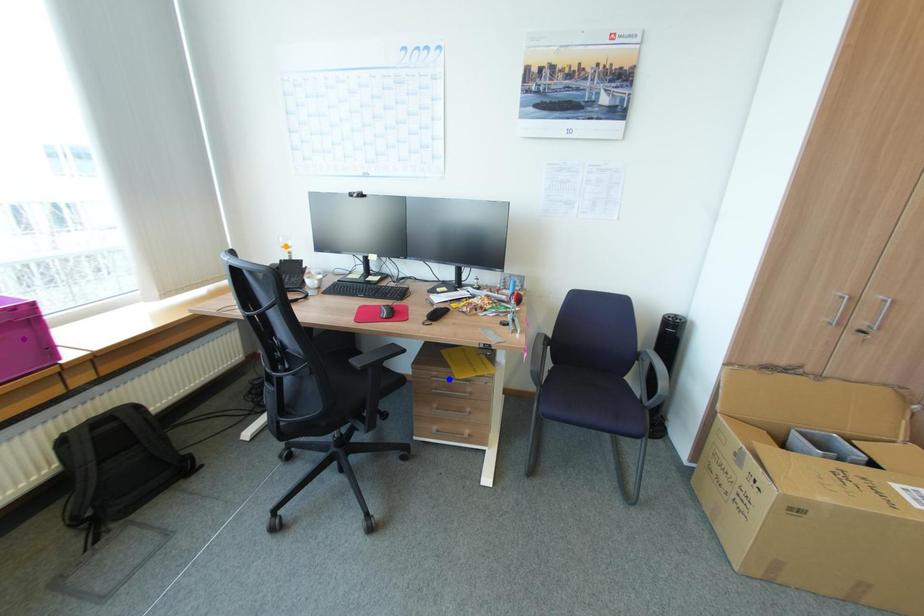
Based on the photo, order these from nearest to farthest:
1. purple point
2. orange point
3. blue point

purple point
blue point
orange point